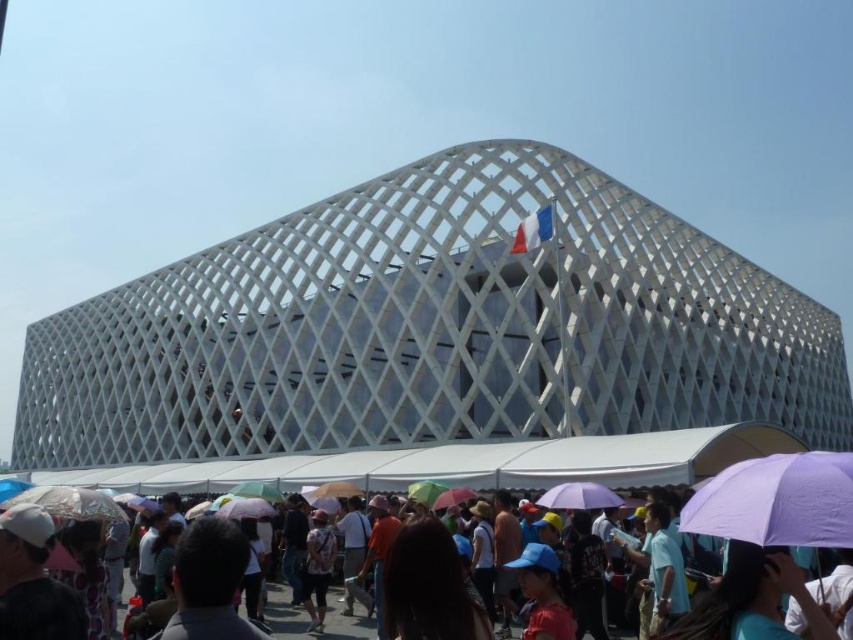
Does transparent plastic umbrella at lower left have a greater height compared to rainbow fabric umbrella at center?

Indeed, transparent plastic umbrella at lower left has a greater height compared to rainbow fabric umbrella at center.

In the scene shown: Is transparent plastic umbrella at lower left wider than rainbow fabric umbrella at center?

Yes, transparent plastic umbrella at lower left is wider than rainbow fabric umbrella at center.

Is point (38, 497) more distant than point (410, 493)?

That is False.

Where is `transparent plastic umbrella at lower left`? This screenshot has height=640, width=853. transparent plastic umbrella at lower left is located at coordinates (68, 502).

Does purple matte umbrella at center have a greater height compared to rainbow fabric umbrella at center?

No, purple matte umbrella at center is not taller than rainbow fabric umbrella at center.

The height and width of the screenshot is (640, 853). Find the location of `purple matte umbrella at center`. purple matte umbrella at center is located at coordinates (579, 497).

This screenshot has width=853, height=640. What do you see at coordinates (257, 490) in the screenshot?
I see `green matte umbrella at lower center` at bounding box center [257, 490].

Between green matte umbrella at lower center and rainbow fabric umbrella at center, which one is positioned higher?

rainbow fabric umbrella at center is higher up.

Locate an element on the screen. This screenshot has height=640, width=853. green matte umbrella at lower center is located at coordinates (257, 490).

I want to click on green matte umbrella at lower center, so click(x=257, y=490).